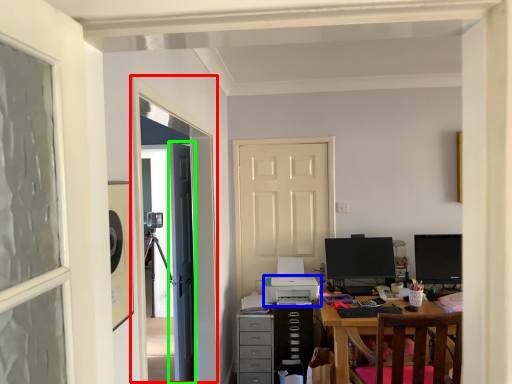
Question: Considering the real-world distances, which object is farthest from screen door (highlighted by a red box)? printer (highlighted by a blue box) or door (highlighted by a green box)?

Choices:
 (A) printer
 (B) door

Answer: (A)